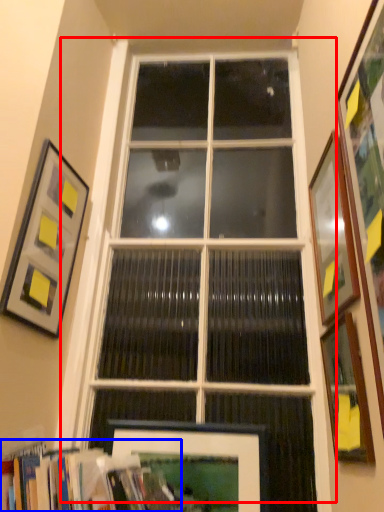
Question: Which of the following is the farthest to the observer, window (highlighted by a red box) or bookcase (highlighted by a blue box)?

Choices:
 (A) window
 (B) bookcase

Answer: (A)